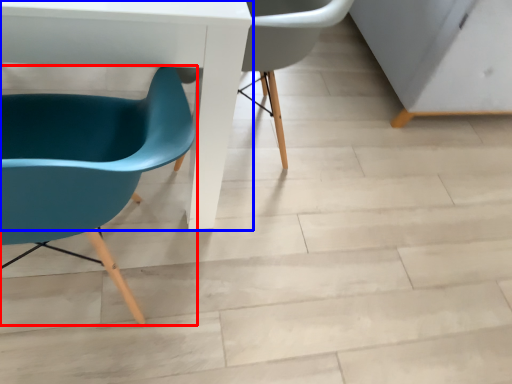
Question: Among these objects, which one is nearest to the camera, chair (highlighted by a red box) or table (highlighted by a blue box)?

Choices:
 (A) chair
 (B) table

Answer: (A)